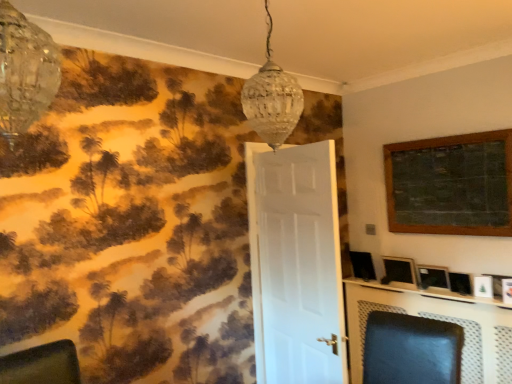
Question: From the image's perspective, is matte black picture frame at right, acting as the second picture frame starting from the top, below clear glass chandelier at upper left, which is counted as the 2th lamp, starting from the right?

Choices:
 (A) yes
 (B) no

Answer: (A)

Question: Does matte black picture frame at right, acting as the second picture frame starting from the top, turn towards clear glass chandelier at upper left, placed as the 2th lamp when sorted from back to front?

Choices:
 (A) no
 (B) yes

Answer: (A)

Question: Is matte black picture frame at right, acting as the second picture frame starting from the top, not inside clear glass chandelier at upper left, placed as the 2th lamp when sorted from back to front?

Choices:
 (A) yes
 (B) no

Answer: (A)

Question: From the image's perspective, is matte black picture frame at right, acting as the second picture frame starting from the top, above clear glass chandelier at upper left, which is counted as the 2th lamp, starting from the right?

Choices:
 (A) no
 (B) yes

Answer: (A)

Question: Can you confirm if matte black picture frame at right, acting as the second picture frame starting from the top, is taller than clear glass chandelier at upper left, placed as the 2th lamp when sorted from back to front?

Choices:
 (A) no
 (B) yes

Answer: (A)

Question: Can you confirm if matte black picture frame at right, acting as the second picture frame starting from the top, is wider than clear glass chandelier at upper left, the first lamp from the left?

Choices:
 (A) no
 (B) yes

Answer: (A)

Question: Is matte black picture frame at right, the first picture frame when ordered from bottom to top, in contact with matte black swivel chair at center?

Choices:
 (A) yes
 (B) no

Answer: (B)

Question: Is matte black picture frame at right, the first picture frame when ordered from bottom to top, bigger than matte black swivel chair at center?

Choices:
 (A) no
 (B) yes

Answer: (A)

Question: Is matte black picture frame at right, the first picture frame when ordered from bottom to top, not within matte black swivel chair at center?

Choices:
 (A) yes
 (B) no

Answer: (A)

Question: Considering the relative positions of matte black picture frame at right, the 4th picture frame positioned from the top, and matte black swivel chair at center in the image provided, is matte black picture frame at right, the 4th picture frame positioned from the top, to the left of matte black swivel chair at center from the viewer's perspective?

Choices:
 (A) yes
 (B) no

Answer: (B)

Question: Is matte black swivel chair at center completely or partially inside matte black picture frame at right, the 4th picture frame positioned from the top?

Choices:
 (A) no
 (B) yes

Answer: (A)

Question: Can you confirm if matte black picture frame at right, the 4th picture frame positioned from the top, is shorter than matte black swivel chair at center?

Choices:
 (A) yes
 (B) no

Answer: (A)

Question: Is white matte door at center at the left side of matte black swivel chair at center?

Choices:
 (A) yes
 (B) no

Answer: (A)